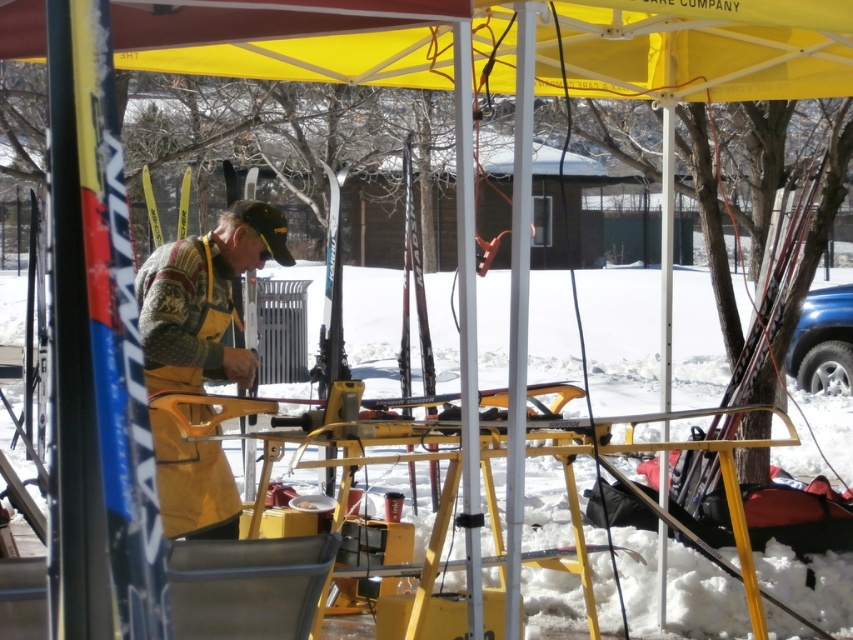
Is yellow fabric canopy at upper center positioned in front of knitted sweater at center?

Yes, yellow fabric canopy at upper center is in front of knitted sweater at center.

Between yellow fabric canopy at upper center and knitted sweater at center, which one has more height?

Standing taller between the two is knitted sweater at center.

Between point (334, 1) and point (158, 467), which one is positioned in front?

Point (334, 1) is in front.

Where is `yellow fabric canopy at upper center`? yellow fabric canopy at upper center is located at coordinates (312, 38).